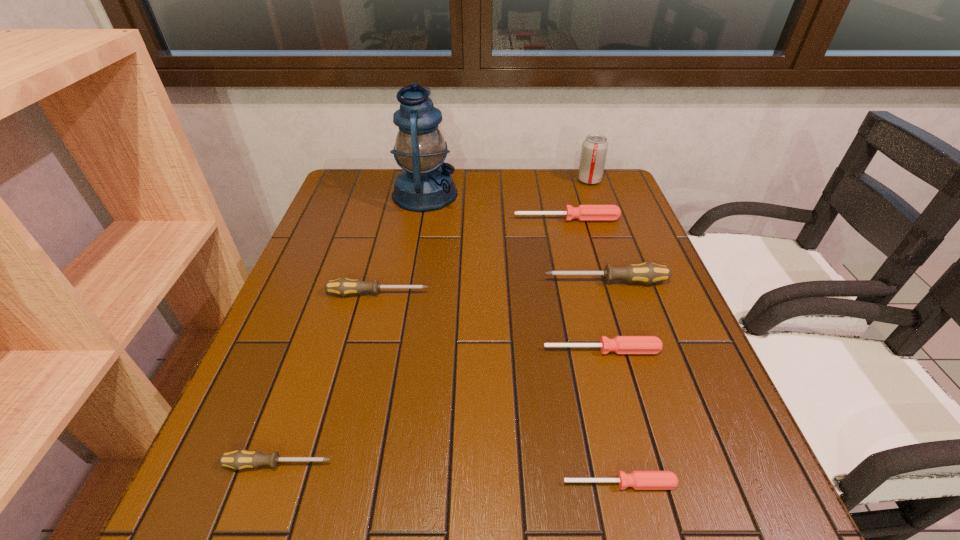
Locate an element on the screen. Image resolution: width=960 pixels, height=540 pixels. vacant region located at the tip of the second smallest gray screwdriver is located at coordinates (476, 293).

You are a GUI agent. You are given a task and a screenshot of the screen. Output one action in this format:
    pyautogui.click(x=<x>, y=<y>)
    Task: Click on the free space located 0.170m on the left of the biggest red screwdriver
    
    Given the screenshot: What is the action you would take?
    pyautogui.click(x=455, y=219)

You are a GUI agent. You are given a task and a screenshot of the screen. Output one action in this format:
    pyautogui.click(x=<x>, y=<y>)
    Task: Click on the free space located on the left of the fourth farthest screwdriver
    This screenshot has height=540, width=960.
    Given the screenshot: What is the action you would take?
    pyautogui.click(x=437, y=350)

I want to click on free spot located 0.200m at the tip of the seventh farthest object, so click(452, 464).

The height and width of the screenshot is (540, 960). I want to click on vacant space located on the left of the nearest screwdriver, so click(508, 483).

You are a GUI agent. You are given a task and a screenshot of the screen. Output one action in this format:
    pyautogui.click(x=<x>, y=<y>)
    Task: Click on the lantern located in the far edge section of the desktop
    
    Given the screenshot: What is the action you would take?
    pyautogui.click(x=425, y=184)

The height and width of the screenshot is (540, 960). Identify the location of soda can that is at the far edge. (594, 148).

This screenshot has height=540, width=960. Identify the location of object at the near edge. click(x=640, y=480).

Where is `soda can located at the right edge`? The width and height of the screenshot is (960, 540). soda can located at the right edge is located at coordinates (594, 148).

Find the location of a particular element. The image size is (960, 540). object present at the far right corner is located at coordinates (594, 148).